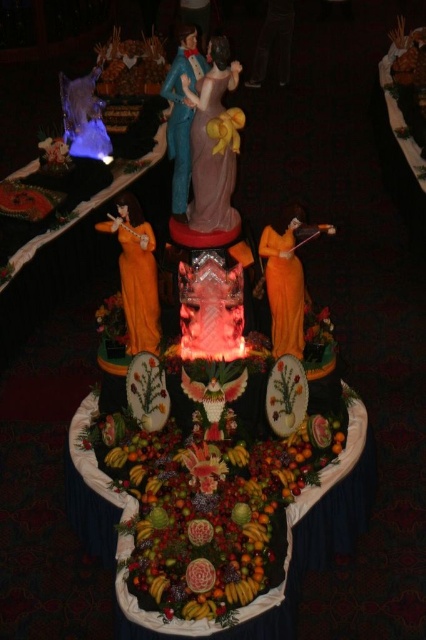
Question: Where is orange fabric statue at center located in relation to orange fabric dress at center in the image?

Choices:
 (A) left
 (B) right

Answer: (A)

Question: Estimate the real-world distances between objects in this image. Which object is farther from the orange fabric statue at center?

Choices:
 (A) pink satin statue at center
 (B) fruit centerpiece at center

Answer: (B)

Question: Which of the following is the farthest from the observer?

Choices:
 (A) orange fabric statue at center
 (B) fruit centerpiece at center
 (C) pink satin statue at center

Answer: (A)

Question: Which point is farther to the camera?

Choices:
 (A) orange fabric statue at center
 (B) pink satin statue at center
 (C) fruit centerpiece at center
 (D) orange fabric dress at center

Answer: (A)

Question: Can you confirm if orange fabric dress at center is bigger than matte blue fabric at center?

Choices:
 (A) yes
 (B) no

Answer: (A)

Question: Can you confirm if orange fabric dress at center is positioned to the left of matte blue fabric at center?

Choices:
 (A) no
 (B) yes

Answer: (A)